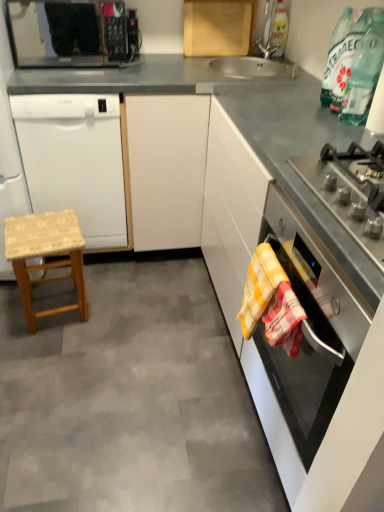
Find the location of a particular element. This screenshot has height=512, width=384. vacant region to the right of woven wood stool at lower left is located at coordinates (118, 310).